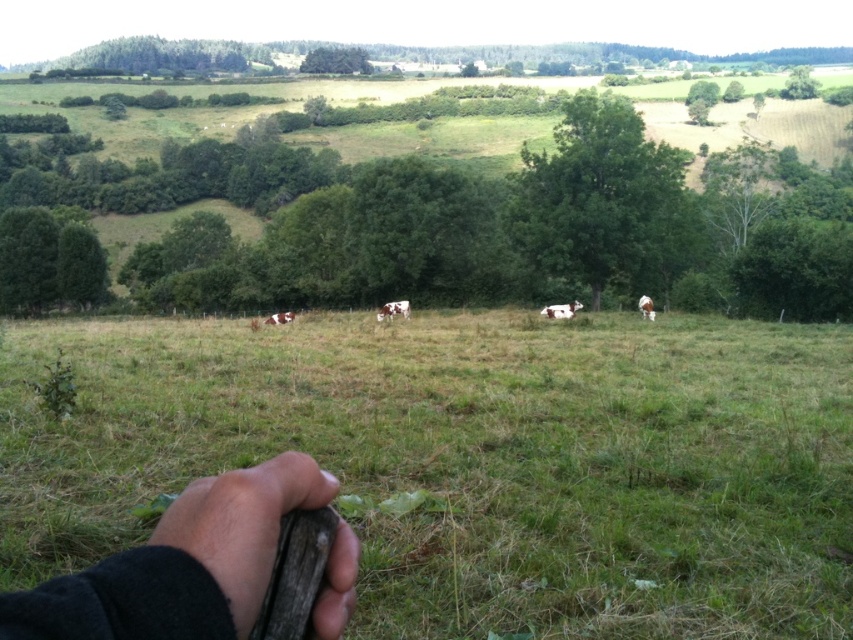
Question: Does white speckled cow at center appear on the left side of brown and white fur at center?

Choices:
 (A) yes
 (B) no

Answer: (B)

Question: Is brown leather hand at lower left to the left of brown speckled cow at center from the viewer's perspective?

Choices:
 (A) yes
 (B) no

Answer: (B)

Question: Considering the real-world distances, which object is farthest from the white speckled cow at center?

Choices:
 (A) brown and white fur at center
 (B) green grassy field at center
 (C) brown speckled cow at center
 (D) brown leather hand at lower left

Answer: (D)

Question: Does green grassy field at center have a smaller size compared to brown speckled cow at right?

Choices:
 (A) no
 (B) yes

Answer: (A)

Question: Which point appears farthest from the camera in this image?

Choices:
 (A) (663, 438)
 (B) (219, 515)
 (C) (642, 296)

Answer: (C)

Question: Which of the following is the closest to the observer?

Choices:
 (A) (643, 314)
 (B) (560, 317)
 (C) (599, 547)
 (D) (264, 323)

Answer: (C)